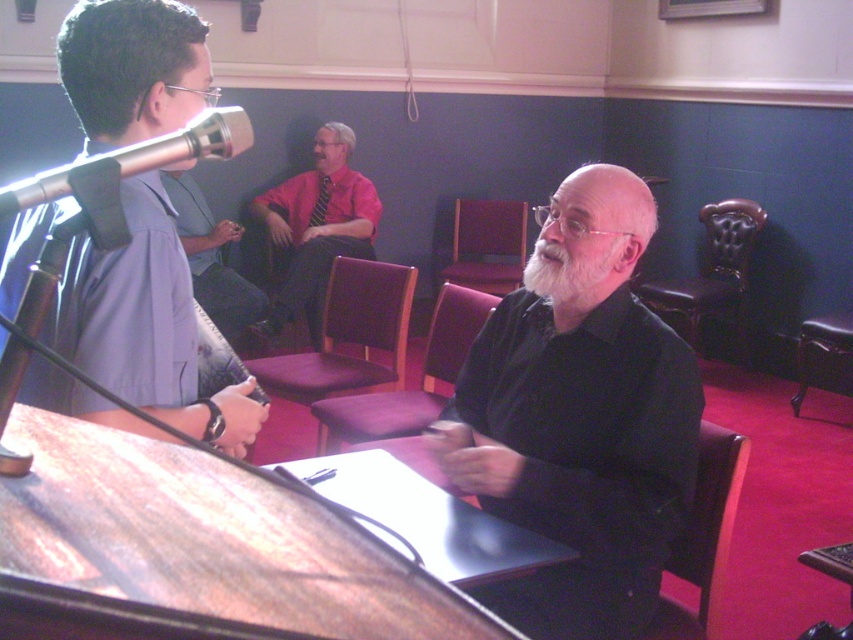
Does matte black shirt at center have a lesser width compared to dark brown leather armchair at lower right?

No, matte black shirt at center is not thinner than dark brown leather armchair at lower right.

Describe the element at coordinates (148, 324) in the screenshot. This screenshot has width=853, height=640. I see `matte black shirt at center` at that location.

Find the location of a particular element. This screenshot has width=853, height=640. matte black shirt at center is located at coordinates (148, 324).

Who is lower down, wooden table at center or matte red shirt at center?

Result: wooden table at center is lower down.

Is wooden table at center above matte red shirt at center?

No, wooden table at center is not above matte red shirt at center.

Between point (289, 632) and point (318, 253), which one is positioned behind?

The point (318, 253) is behind.

I want to click on wooden table at center, so click(x=204, y=541).

Image resolution: width=853 pixels, height=640 pixels. What do you see at coordinates (317, 227) in the screenshot?
I see `matte red shirt at center` at bounding box center [317, 227].

Measure the distance between matte red shirt at center and leather tufted armchair at right.

matte red shirt at center and leather tufted armchair at right are 1.98 meters apart from each other.

You are a GUI agent. You are given a task and a screenshot of the screen. Output one action in this format:
    pyautogui.click(x=<x>, y=<y>)
    Task: Click on the matte red shirt at center
    The height and width of the screenshot is (640, 853).
    Given the screenshot: What is the action you would take?
    pyautogui.click(x=317, y=227)